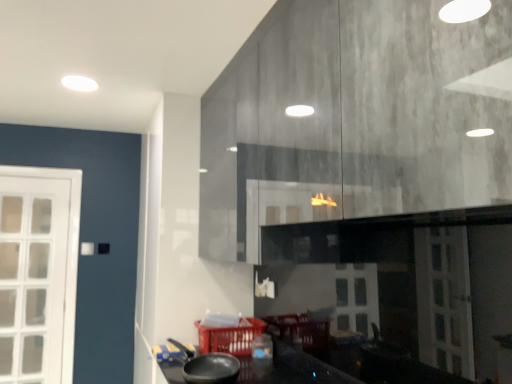
Question: Is black matte wok at lower center positioned in front of matte plastic basket at lower center?

Choices:
 (A) no
 (B) yes

Answer: (B)

Question: Is black matte wok at lower center positioned behind matte plastic basket at lower center?

Choices:
 (A) no
 (B) yes

Answer: (A)

Question: Is black matte wok at lower center far from matte plastic basket at lower center?

Choices:
 (A) yes
 (B) no

Answer: (B)

Question: Is black matte wok at lower center positioned with its back to matte plastic basket at lower center?

Choices:
 (A) no
 (B) yes

Answer: (A)

Question: From a real-world perspective, is black matte wok at lower center on top of matte plastic basket at lower center?

Choices:
 (A) no
 (B) yes

Answer: (B)

Question: From a real-world perspective, is black matte wok at lower center below matte plastic basket at lower center?

Choices:
 (A) yes
 (B) no

Answer: (B)

Question: Is matte plastic basket at lower center turned away from black matte wok at lower center?

Choices:
 (A) yes
 (B) no

Answer: (B)

Question: Is black matte wok at lower center inside matte plastic basket at lower center?

Choices:
 (A) no
 (B) yes

Answer: (A)

Question: Is matte plastic basket at lower center smaller than black matte wok at lower center?

Choices:
 (A) no
 (B) yes

Answer: (A)

Question: Does matte plastic basket at lower center appear on the right side of black matte wok at lower center?

Choices:
 (A) yes
 (B) no

Answer: (A)

Question: Does matte plastic basket at lower center have a lesser width compared to black matte wok at lower center?

Choices:
 (A) no
 (B) yes

Answer: (A)

Question: Considering the relative sizes of matte plastic basket at lower center and black matte wok at lower center in the image provided, is matte plastic basket at lower center wider than black matte wok at lower center?

Choices:
 (A) yes
 (B) no

Answer: (A)

Question: Which is correct: matte plastic basket at lower center is inside black matte wok at lower center, or outside of it?

Choices:
 (A) inside
 (B) outside

Answer: (B)